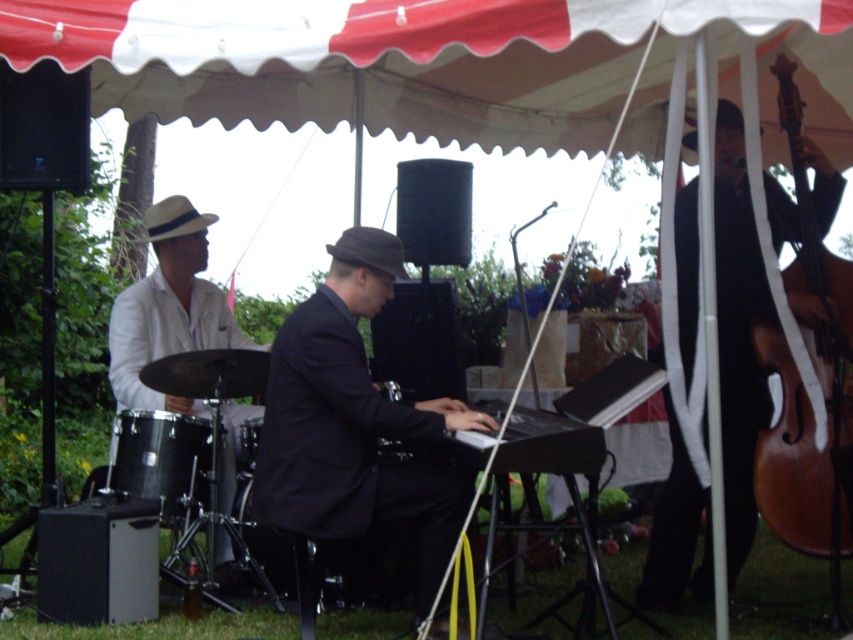
You are attending the outdoor musical performance and want to take a photo of the two points mentioned. Which point, point (186, 483) or point (277, 531), will appear larger in your camera view?

Point (186, 483) is closer to the viewer than point (277, 531), so it will appear larger in the camera view.

You are a photographer at the event and want to take a photo that includes both the wooden bass at right and the beige felt fedora at left. Based on their positions, can you ensure that both objects will be fully visible in the frame without any part being cut off?

The wooden bass at right is positioned under the beige felt fedora at left. This means the bass is located below the hat in the image, so as long as the camera frame includes both the lower and upper areas where they are placed, both objects should be fully visible without any parts being cut off.

You are a photographer at the event and want to capture a photo of both the wooden bass at right and the beige felt fedora at left. Which object should you position closer to the left side of the frame to include both in the photo?

You should position the beige felt fedora at left closer to the left side of the frame since it is already to the left of the wooden bass at right, ensuring both are included in the photo.